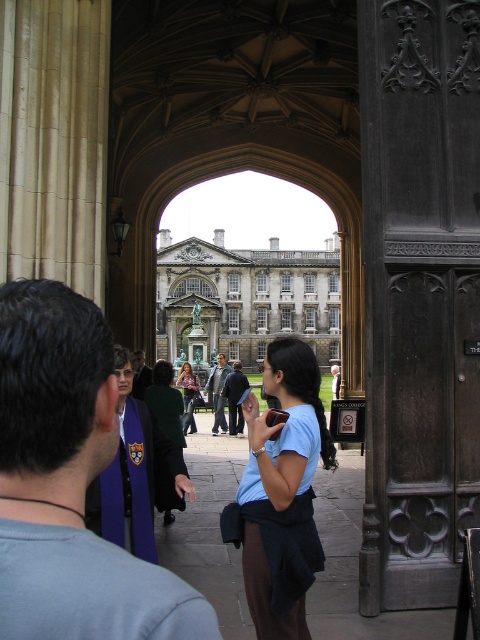
Can you confirm if stone gray building at center is positioned to the left of dark green wool coat at center?

No, stone gray building at center is not to the left of dark green wool coat at center.

The height and width of the screenshot is (640, 480). What are the coordinates of `stone gray building at center` in the screenshot? It's located at (243, 300).

Can you confirm if stone gray building at center is wider than matte pink shirt at center?

Correct, the width of stone gray building at center exceeds that of matte pink shirt at center.

Where is `stone gray building at center`? stone gray building at center is located at coordinates (243, 300).

Who is higher up, blue fabric graduation gown at center or matte pink shirt at center?

matte pink shirt at center is higher up.

Identify the location of blue fabric graduation gown at center. This screenshot has height=640, width=480. (70, 483).

Who is more forward, (93,420) or (189,381)?

Point (93,420) is more forward.

What are the coordinates of `blue fabric graduation gown at center` in the screenshot? It's located at (70, 483).